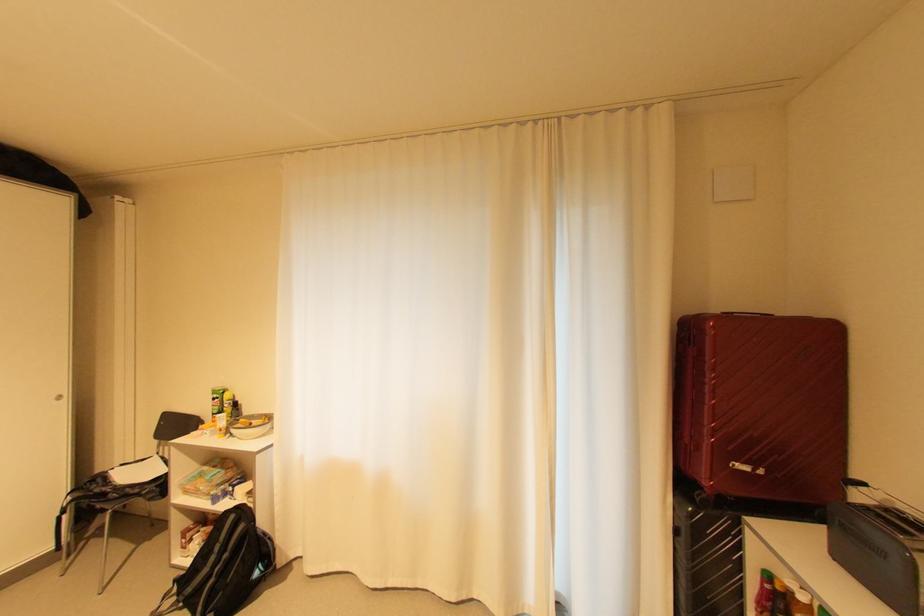
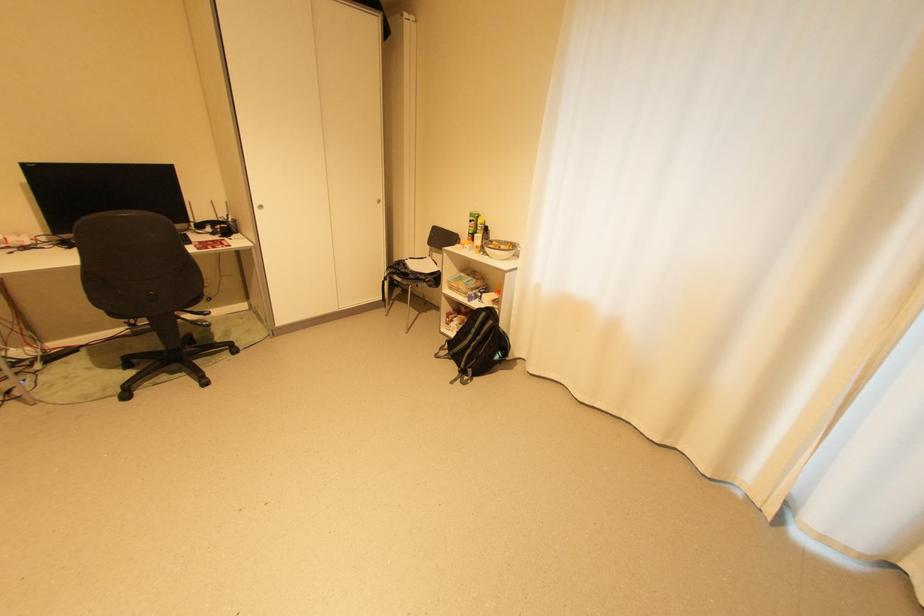
Locate, in the second image, the point that corresponds to (239,517) in the first image.

(492, 314)